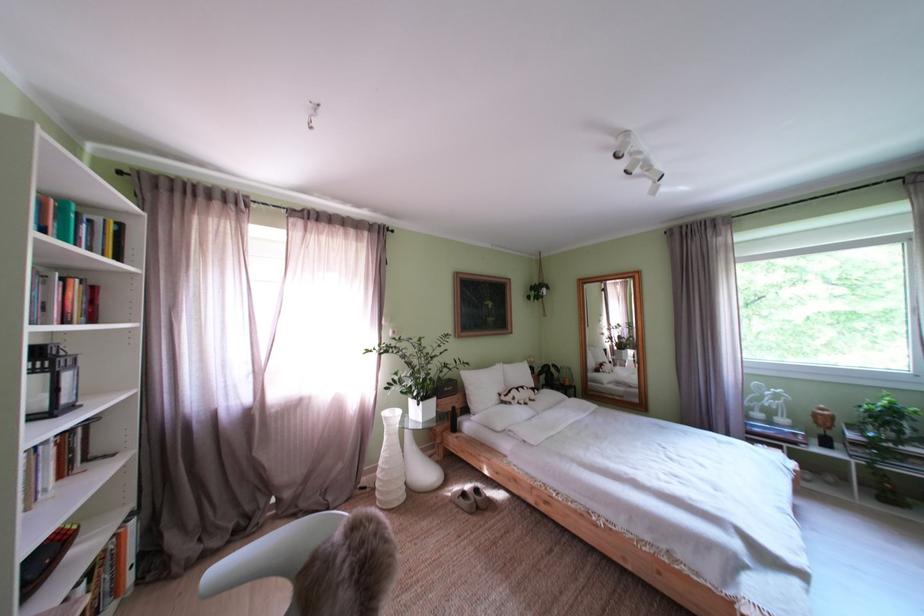
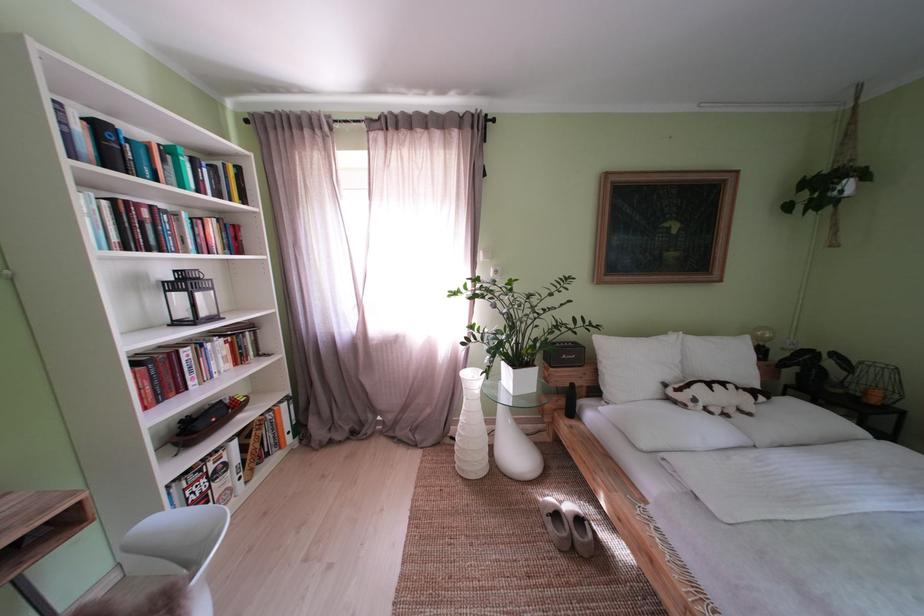
Locate, in the second image, the point that corresponds to point (525, 405) in the first image.

(706, 406)